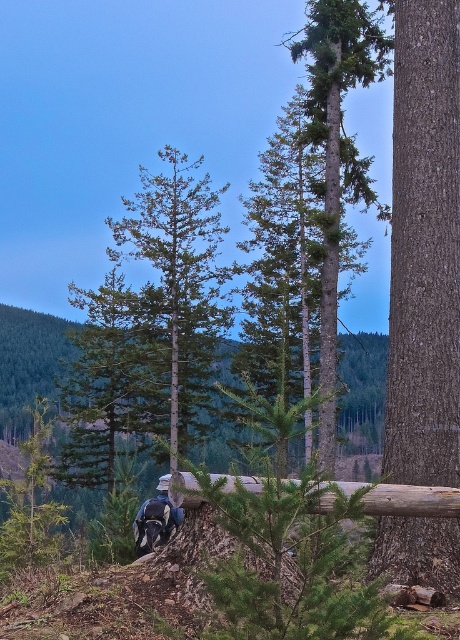
Can you confirm if smooth brown tree trunk at right is positioned to the right of dark blue fabric mountain biker at center?

Indeed, smooth brown tree trunk at right is positioned on the right side of dark blue fabric mountain biker at center.

The image size is (460, 640). Identify the location of smooth brown tree trunk at right. (425, 248).